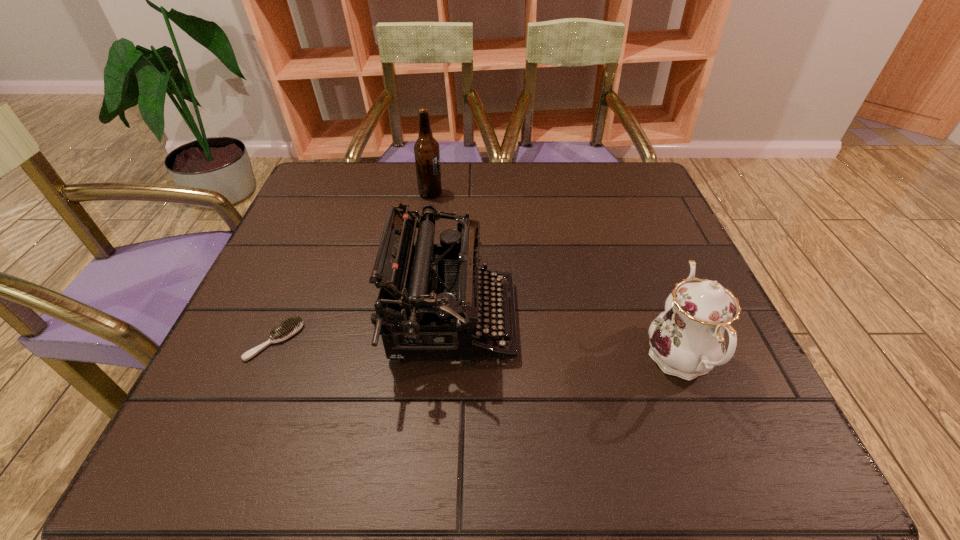
What are the coordinates of `object present at the left edge` in the screenshot? It's located at point(290,327).

In order to click on object located in the right edge section of the desktop in this screenshot , I will do `click(687, 340)`.

Where is `free space at the far edge of the desktop`? free space at the far edge of the desktop is located at coordinates (492, 201).

In the image, there is a desktop. Where is `free region at the near edge`? This screenshot has width=960, height=540. free region at the near edge is located at coordinates (606, 431).

In order to click on vacant point at the left edge in this screenshot , I will do `click(284, 396)`.

The height and width of the screenshot is (540, 960). Find the location of `free space at the right edge of the desktop`. free space at the right edge of the desktop is located at coordinates (682, 251).

The height and width of the screenshot is (540, 960). In the image, there is a desktop. In order to click on free space at the far left corner in this screenshot , I will do `click(338, 181)`.

In the image, there is a desktop. At what (x,y) coordinates should I click in order to perform the action: click on vacant space at the far right corner. Please return your answer as a coordinate pair (x, y). The width and height of the screenshot is (960, 540). Looking at the image, I should click on (605, 163).

The width and height of the screenshot is (960, 540). I want to click on empty location between the beer bottle and the chinaware, so click(555, 276).

The image size is (960, 540). Find the location of `vacant area between the shortest object and the typewriter`. vacant area between the shortest object and the typewriter is located at coordinates (363, 330).